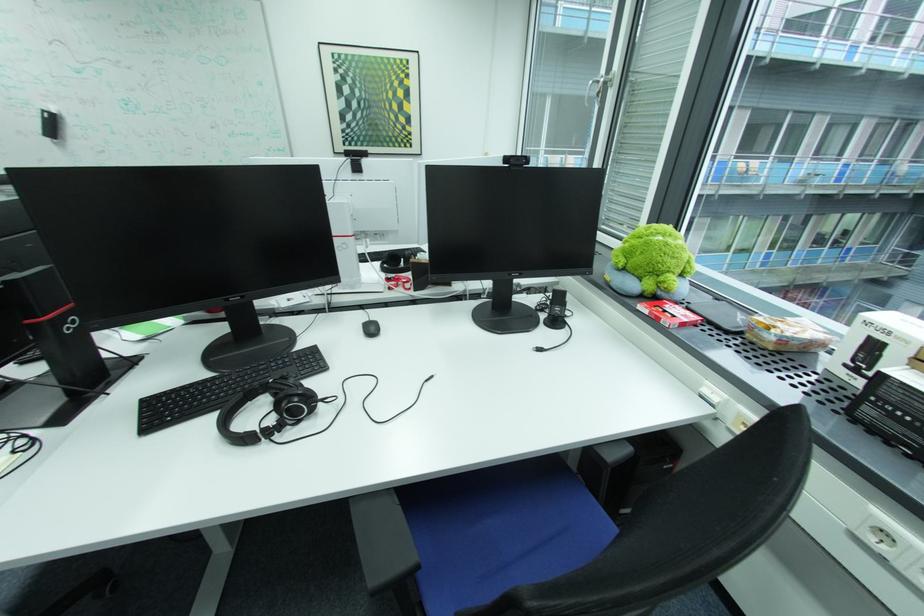
The width and height of the screenshot is (924, 616). Find the location of `silver window handle`. silver window handle is located at coordinates [x=603, y=94].